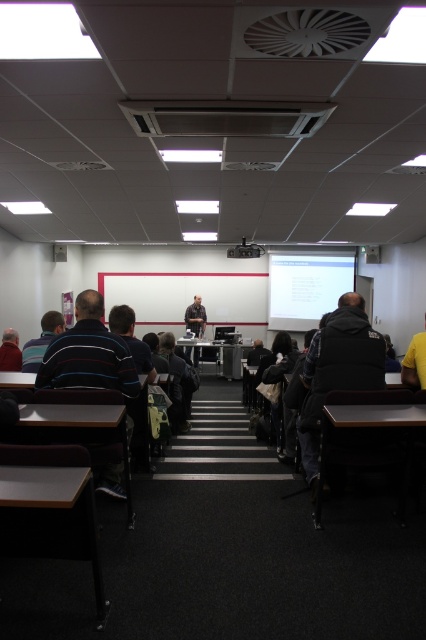
Question: Can you confirm if white glossy projector screen at upper right is thinner than matte black projector at upper center?

Choices:
 (A) no
 (B) yes

Answer: (A)

Question: Which of the following is the farthest from the observer?

Choices:
 (A) striped shirt at lower left
 (B) yellow fabric at right
 (C) matte black projector at upper center

Answer: (C)

Question: Estimate the real-world distances between objects in this image. Which object is closer to the white matte table at lower left?

Choices:
 (A) matte black projector at upper center
 (B) metallic silver table at center
 (C) dark blue shirt at lower left
 (D) dark gray jacket at center

Answer: (C)

Question: Is white matte table at lower left to the left of matte black table at lower right from the viewer's perspective?

Choices:
 (A) yes
 (B) no

Answer: (A)

Question: Which of these objects is positioned farthest from the yellow fabric at right?

Choices:
 (A) black fuzzy vest at right
 (B) dark blue shirt at lower left
 (C) striped fabric shirt at left
 (D) white matte table at lower left

Answer: (B)

Question: Can you confirm if striped fabric shirt at left is positioned above matte black table at lower left?

Choices:
 (A) no
 (B) yes

Answer: (B)